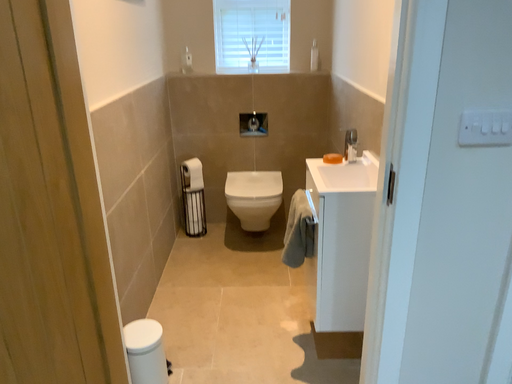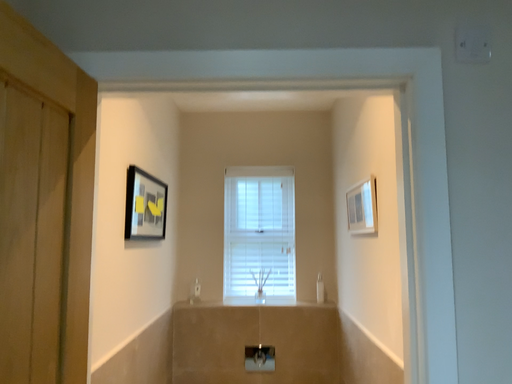
Question: Which way did the camera rotate in the video?

Choices:
 (A) rotated downward
 (B) rotated upward

Answer: (B)